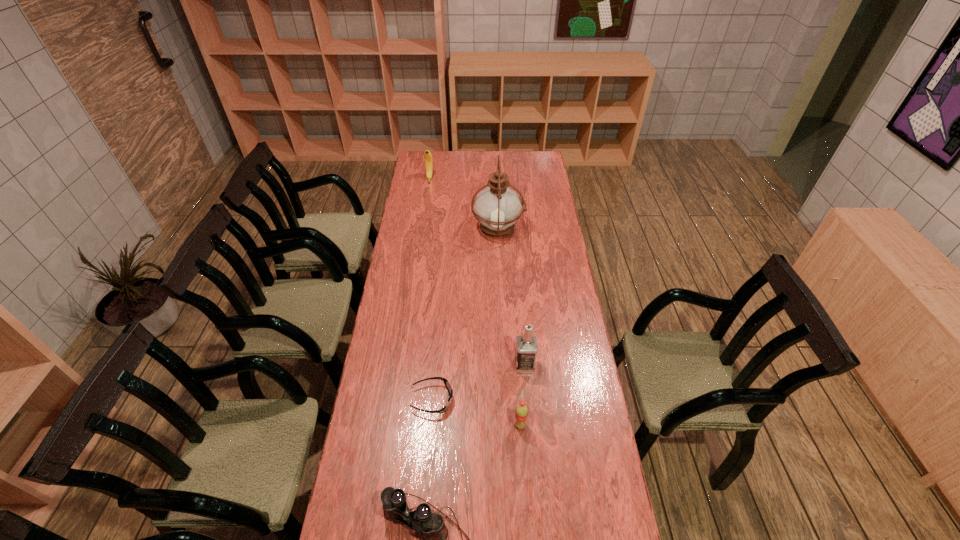
The height and width of the screenshot is (540, 960). Identify the location of vacant space located 0.160m on the front label of the vodka. (471, 365).

Where is `free region located on the front label of the vodka`? This screenshot has width=960, height=540. free region located on the front label of the vodka is located at coordinates (498, 365).

Find the location of a particular element. The width and height of the screenshot is (960, 540). vacant area situated on the front label of the vodka is located at coordinates (441, 365).

You are a GUI agent. You are given a task and a screenshot of the screen. Output one action in this format:
    pyautogui.click(x=<x>, y=<y>)
    Task: Click on the vacant space situated 0.150m from the stem of the farthest object
    
    Given the screenshot: What is the action you would take?
    pyautogui.click(x=426, y=200)

Where is `blank area located on the left of the soda`? The width and height of the screenshot is (960, 540). blank area located on the left of the soda is located at coordinates (435, 425).

I want to click on free point located 0.050m on the lenses of the sunglasses, so click(x=468, y=400).

Identify the location of banana that is at the left edge. The height and width of the screenshot is (540, 960). (428, 158).

Where is `sunglasses located in the left edge section of the desktop`? sunglasses located in the left edge section of the desktop is located at coordinates (447, 384).

Image resolution: width=960 pixels, height=540 pixels. Identify the location of free location at the far edge of the desktop. (492, 153).

In the image, there is a desktop. In order to click on vacant space at the left edge in this screenshot , I will do `click(406, 225)`.